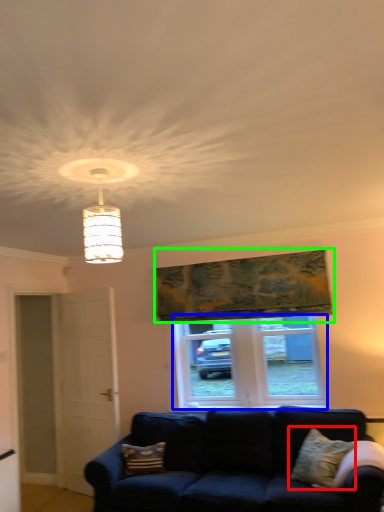
Question: Considering the real-world distances, which object is farthest from pillow (highlighted by a red box)? window (highlighted by a blue box) or tapestry (highlighted by a green box)?

Choices:
 (A) window
 (B) tapestry

Answer: (B)